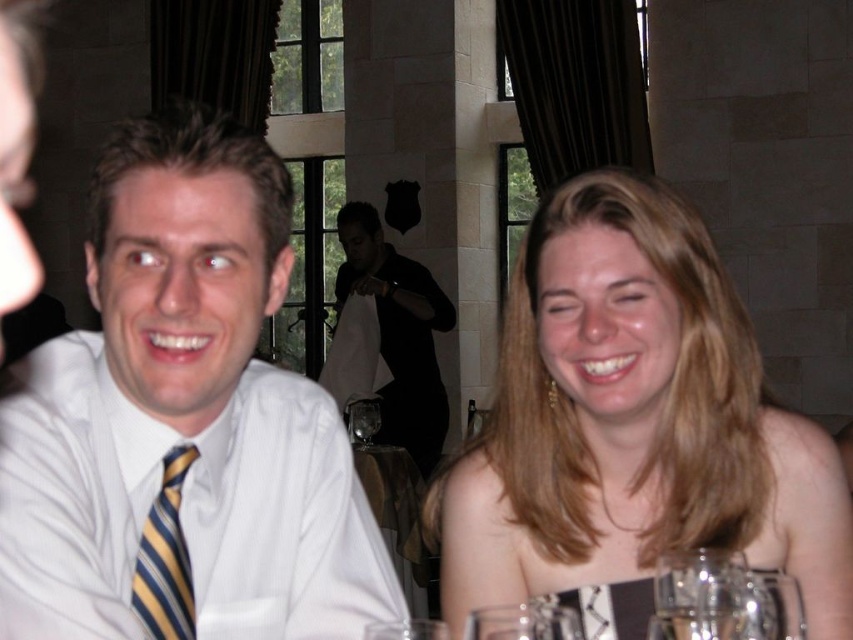
You are a photographer at the event and need to adjust the lighting to ensure both the black matte shirt at center and the yellow striped tie at left are visible. Which object is closer to the light source?

The black matte shirt at center is positioned over the yellow striped tie at left, so it is closer to the light source.